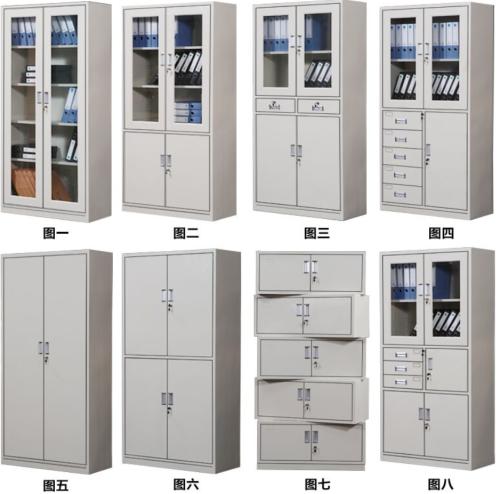
The image size is (500, 494). What are the coordinates of `brown basket in top left class cabinet bottom` in the screenshot? It's located at (24, 181).